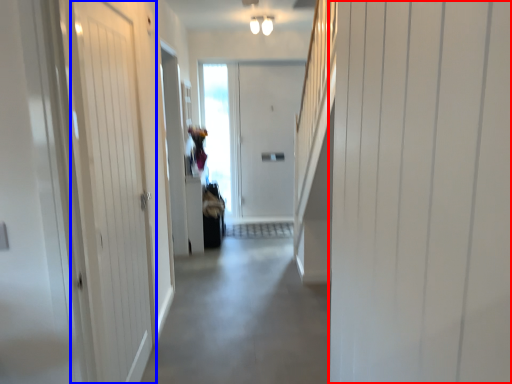
Question: Which of the following is the closest to the observer, door (highlighted by a red box) or door (highlighted by a blue box)?

Choices:
 (A) door
 (B) door

Answer: (A)